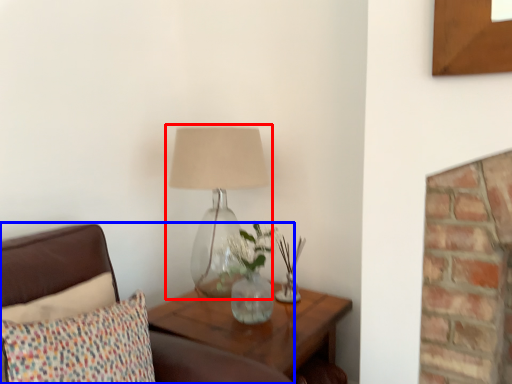
Question: Which object is further to the camera taking this photo, lamp (highlighted by a red box) or furniture (highlighted by a blue box)?

Choices:
 (A) lamp
 (B) furniture

Answer: (A)